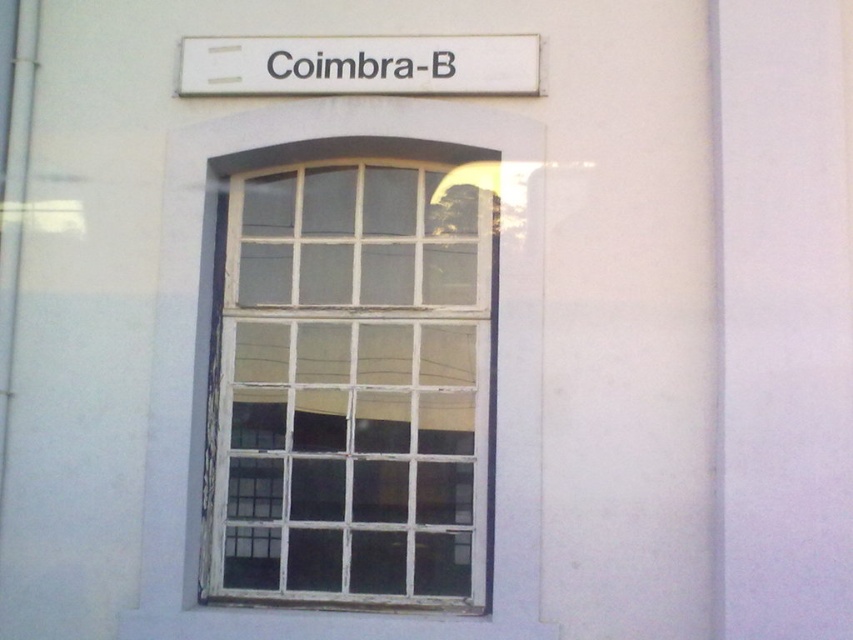
Is point (457, 305) closer to camera compared to point (492, 35)?

No, it is not.

Can you confirm if white wooden window at center is shorter than white plastic sign at upper center?

In fact, white wooden window at center may be taller than white plastic sign at upper center.

Is point (465, 253) more distant than point (451, 84)?

Yes, point (465, 253) is farther from viewer.

Identify the location of white wooden window at center. Image resolution: width=853 pixels, height=640 pixels. (347, 381).